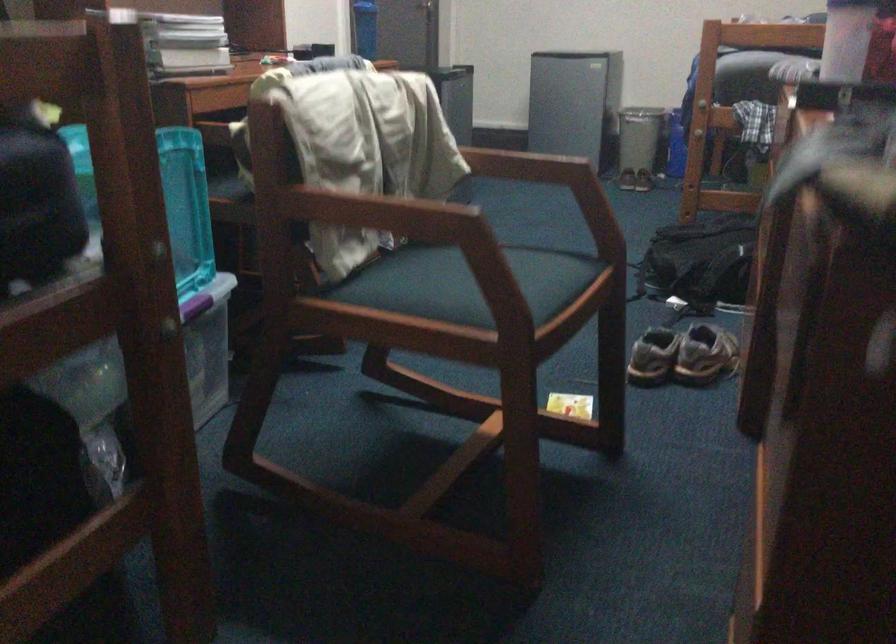
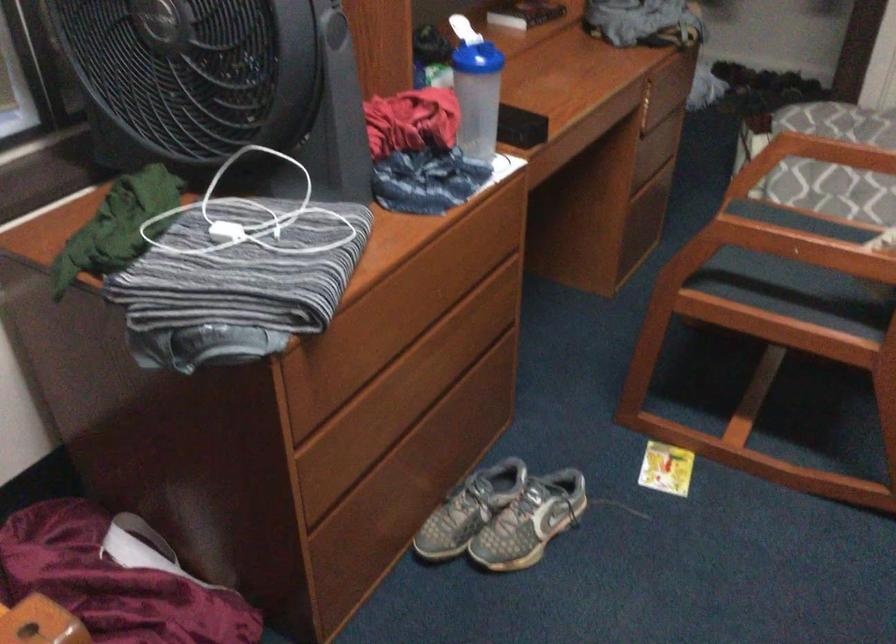
Find the pixel in the second image that matches [526,171] in the first image.

(790, 245)